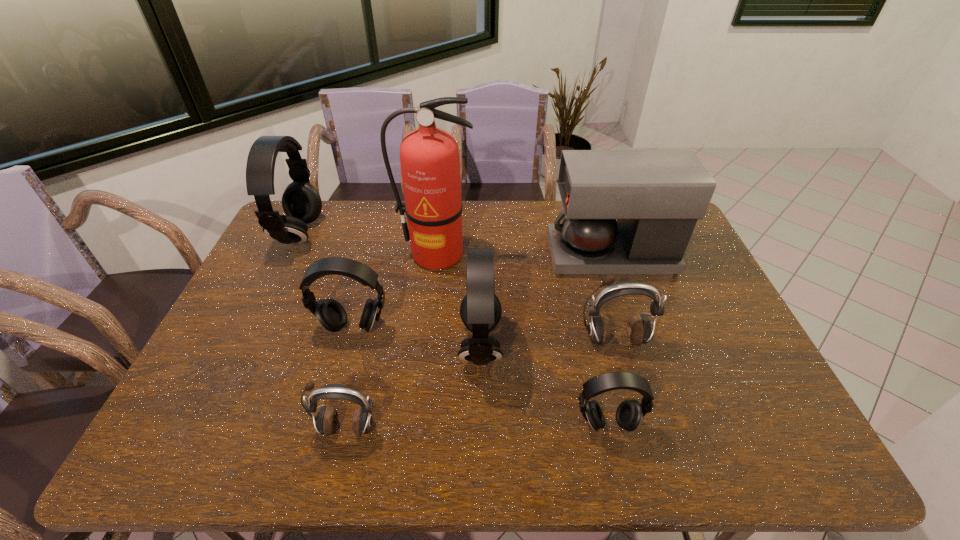
The image size is (960, 540). In order to click on red fire extinguisher in this screenshot , I will do `click(429, 157)`.

You are a GUI agent. You are given a task and a screenshot of the screen. Output one action in this format:
    pyautogui.click(x=<x>, y=<y>)
    Task: Click on the fire extinguisher
    This screenshot has height=540, width=960.
    Given the screenshot: What is the action you would take?
    pyautogui.click(x=429, y=157)

The width and height of the screenshot is (960, 540). What are the coordinates of `the leftmost earphone` in the screenshot? It's located at (301, 202).

Where is `the biggest black earphone`? The height and width of the screenshot is (540, 960). the biggest black earphone is located at coordinates (301, 202).

In order to click on coffee maker in this screenshot , I will do `click(657, 196)`.

Locate an element on the screen. This screenshot has height=540, width=960. the third earphone from right to left is located at coordinates (480, 310).

Find the location of `the second black earphone from right to left`. the second black earphone from right to left is located at coordinates (480, 310).

Identify the location of the third biggest black earphone. (330, 313).

Locate an element on the screen. Image resolution: width=960 pixels, height=540 pixels. the bigger brown earphone is located at coordinates (639, 331).

Locate an element on the screen. This screenshot has height=540, width=960. the farther brown earphone is located at coordinates (639, 331).